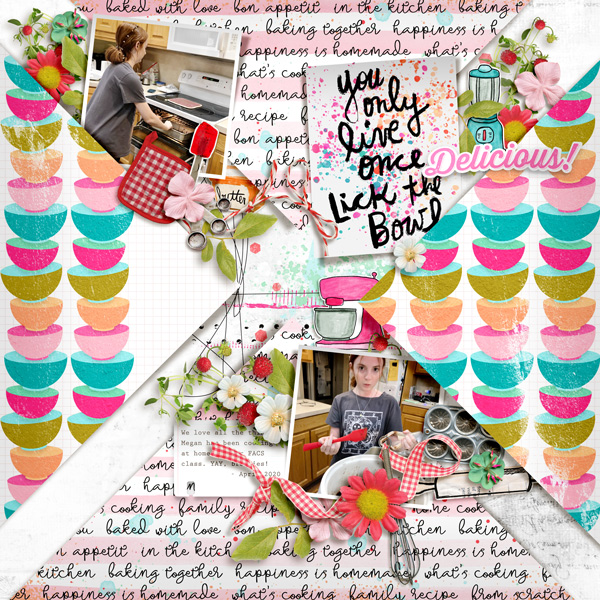
This screenshot has height=600, width=600. Identify the location of stove. (202, 112).